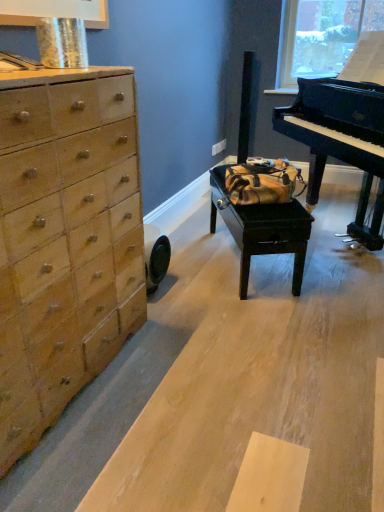
The height and width of the screenshot is (512, 384). In order to click on vacant area that lies to the right of wooden table at center in this screenshot , I will do `click(330, 263)`.